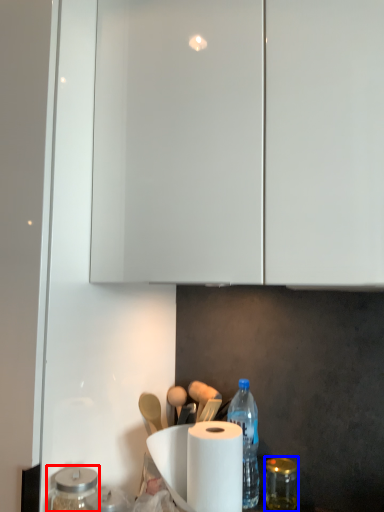
Question: Which object is closer to the camera taking this photo, glass jar (highlighted by a red box) or glass jar (highlighted by a blue box)?

Choices:
 (A) glass jar
 (B) glass jar

Answer: (A)